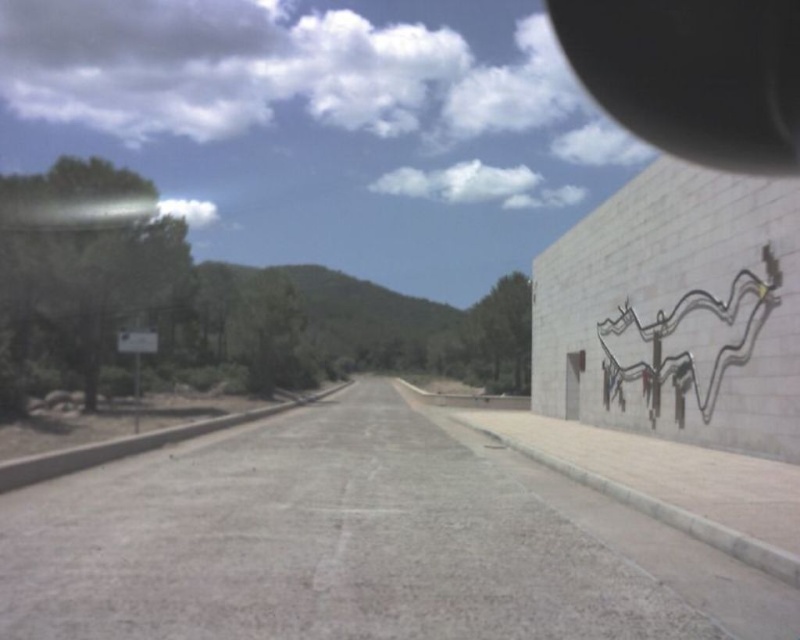
Which is more to the left, black rubber view mirror at upper right or metallic silver octopus at right?

metallic silver octopus at right is more to the left.

Which is in front, point (564, 36) or point (618, 390)?

Point (618, 390) is more forward.

Locate an element on the screen. The image size is (800, 640). black rubber view mirror at upper right is located at coordinates (692, 74).